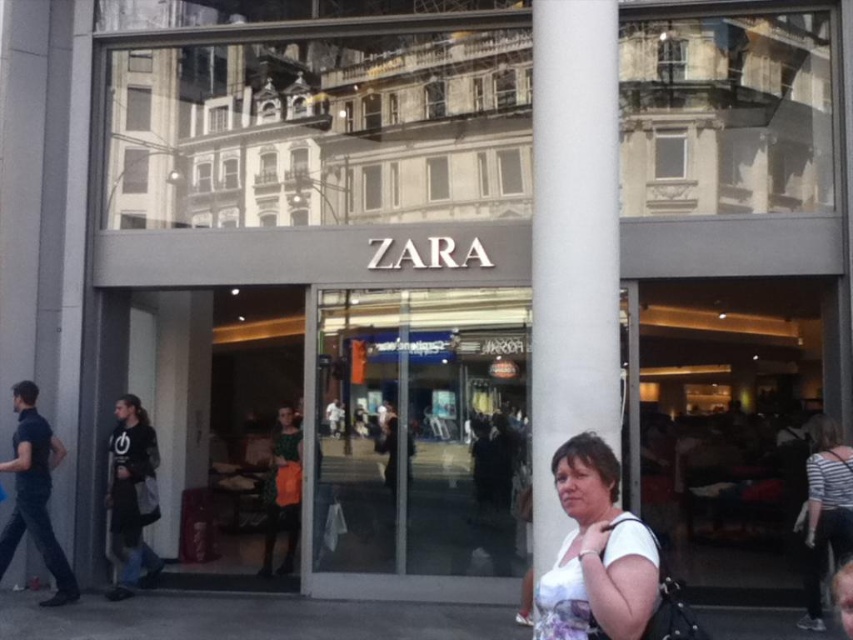
Question: Considering the real-world distances, which object is farthest from the white smooth pillar at center?

Choices:
 (A) green textured dress at center
 (B) white striped shirt at lower right
 (C) white fabric at lower right

Answer: (A)

Question: Does white smooth pillar at center have a larger size compared to white fabric at lower right?

Choices:
 (A) yes
 (B) no

Answer: (A)

Question: Does white fabric at lower right have a smaller size compared to green textured dress at center?

Choices:
 (A) no
 (B) yes

Answer: (B)

Question: Can you confirm if white striped shirt at lower right is smaller than green textured dress at center?

Choices:
 (A) yes
 (B) no

Answer: (B)

Question: Which point is farther to the camera?

Choices:
 (A) white fabric at lower right
 (B) white striped shirt at lower right

Answer: (B)

Question: Which object appears closest to the camera in this image?

Choices:
 (A) black cotton shirt at left
 (B) white fabric at lower right
 (C) white striped shirt at lower right
 (D) dark blue cotton shirt at left

Answer: (B)